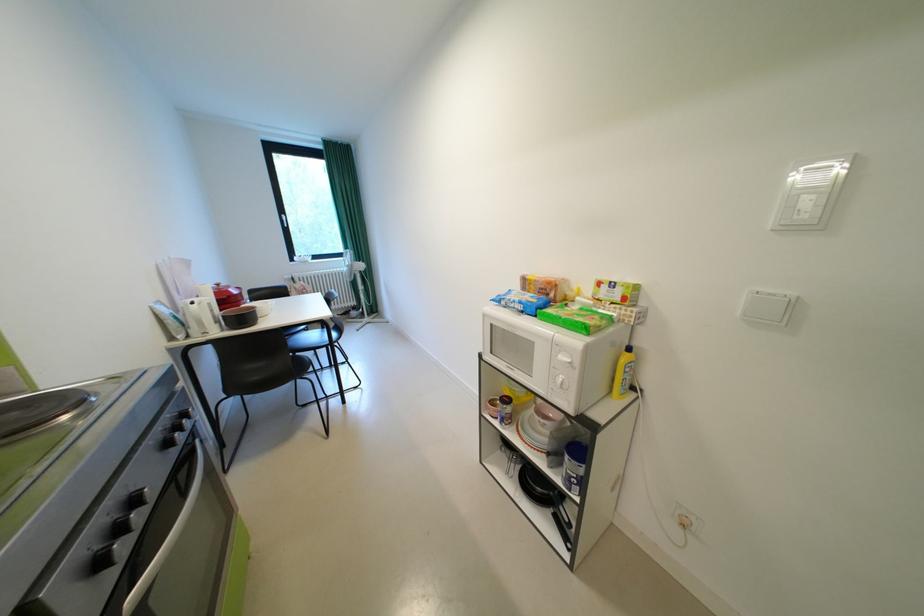
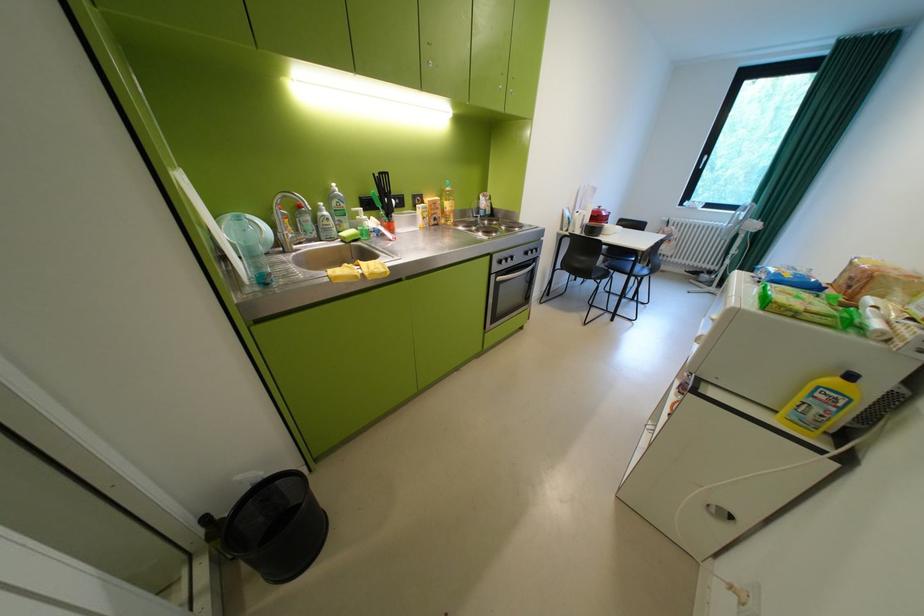
Locate, in the second image, the point that corresponds to point 183,339 in the first image.

(572, 230)